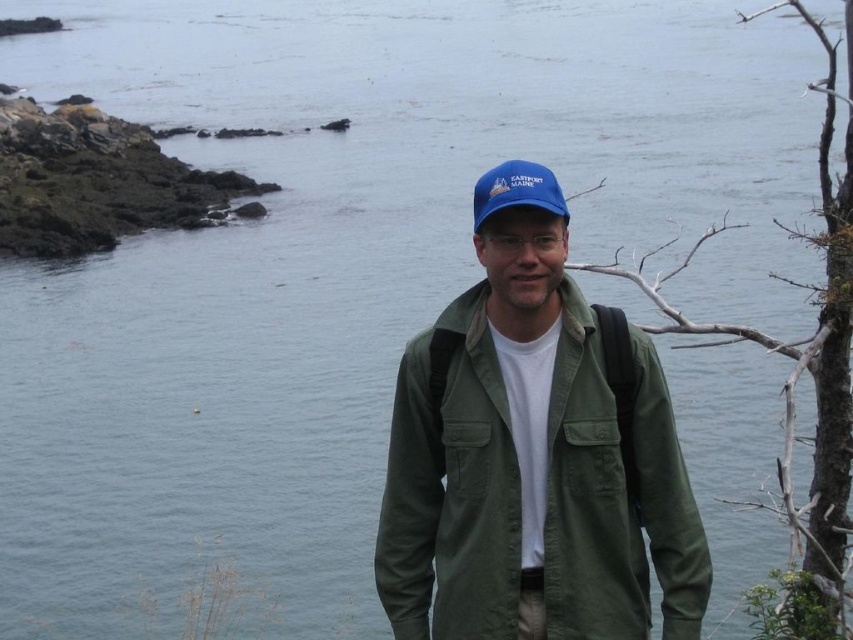
Question: Is green cotton jacket at center below blue fabric cap at center?

Choices:
 (A) yes
 (B) no

Answer: (A)

Question: Which point is closer to the camera?

Choices:
 (A) (485, 211)
 (B) (430, 426)

Answer: (A)

Question: Does green cotton jacket at center appear on the left side of blue fabric cap at center?

Choices:
 (A) yes
 (B) no

Answer: (B)

Question: In this image, where is green cotton jacket at center located relative to blue fabric cap at center?

Choices:
 (A) right
 (B) left

Answer: (A)

Question: Which of the following is the closest to the observer?

Choices:
 (A) green cotton jacket at center
 (B) blue fabric cap at center

Answer: (B)